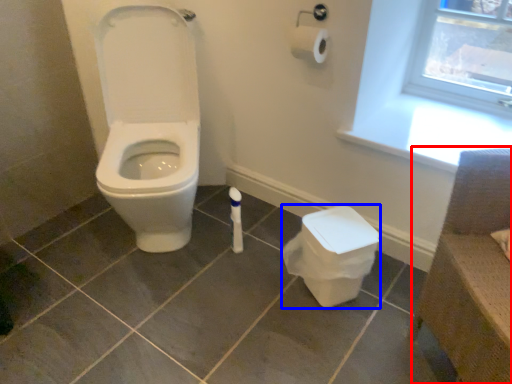
Question: Which object appears farthest to the camera in this image, chair (highlighted by a red box) or potty (highlighted by a blue box)?

Choices:
 (A) chair
 (B) potty

Answer: (B)